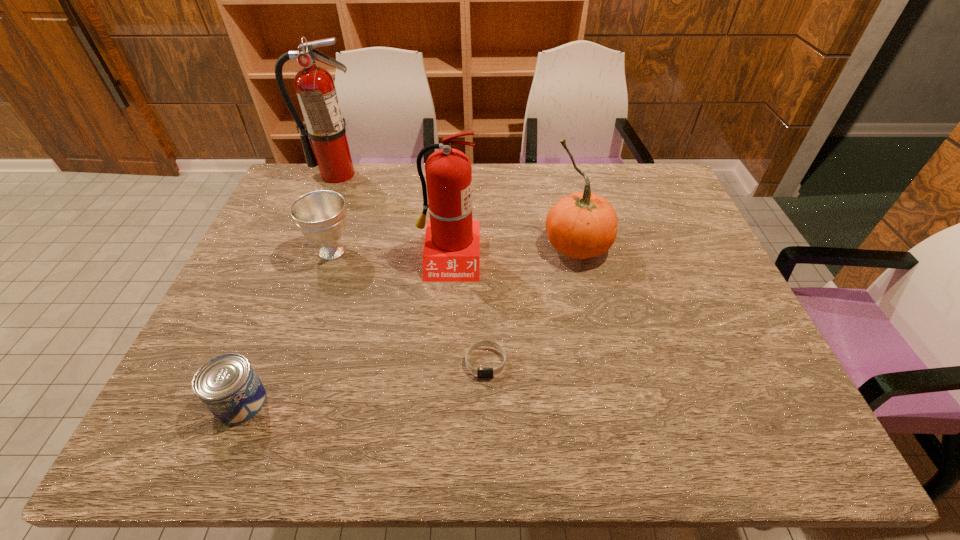
At what (x,y) coordinates should I click in order to perform the action: click on vacant area that lies between the wristband and the chalice. Please return your answer as a coordinate pair (x, y). The height and width of the screenshot is (540, 960). Looking at the image, I should click on (409, 307).

Where is `unoccupied area between the shortest object and the farthest object`? The width and height of the screenshot is (960, 540). unoccupied area between the shortest object and the farthest object is located at coordinates (411, 268).

The height and width of the screenshot is (540, 960). Find the location of `free space between the farthest object and the second tallest object`. free space between the farthest object and the second tallest object is located at coordinates (393, 215).

The image size is (960, 540). Find the location of `vacant space that is in between the rightmost object and the nearest object`. vacant space that is in between the rightmost object and the nearest object is located at coordinates (409, 323).

You are a GUI agent. You are given a task and a screenshot of the screen. Output one action in this format:
    pyautogui.click(x=<x>, y=<y>)
    Task: Click on the vacant area that lies between the can and the second tallest object
    
    Given the screenshot: What is the action you would take?
    pyautogui.click(x=345, y=329)

Locate an element on the screen. This screenshot has height=540, width=960. empty location between the shorter fire extinguisher and the chalice is located at coordinates (391, 254).

Locate an element on the screen. The width and height of the screenshot is (960, 540). vacant space that's between the fourth tallest object and the wristband is located at coordinates (409, 307).

Image resolution: width=960 pixels, height=540 pixels. What are the coordinates of `object that is the third closest to the tallest object` in the screenshot? It's located at (583, 225).

Find the location of `object identified as the fifth closest to the third shortest object`. object identified as the fifth closest to the third shortest object is located at coordinates (583, 225).

At what (x,y) coordinates should I click in order to perform the action: click on free spot that satisfies the following two spatial constraints: 1. on the nozzle side of the tallest object; 2. on the right side of the third tallest object. Please return your answer as a coordinate pair (x, y). The height and width of the screenshot is (540, 960). Looking at the image, I should click on (308, 246).